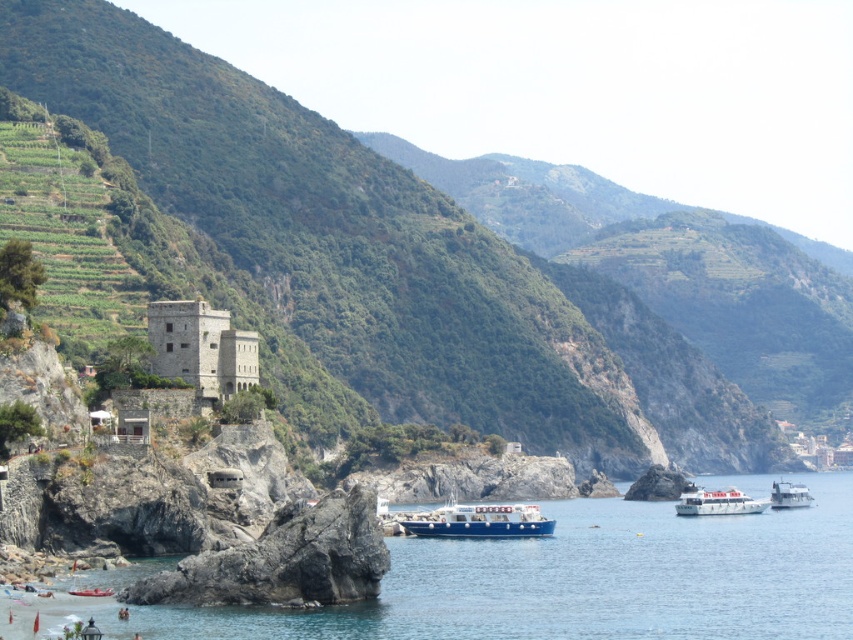
Does white glossy ferry at center come in front of white glossy boat at lower right?

Yes, it is in front of white glossy boat at lower right.

Between point (726, 490) and point (776, 481), which one is positioned behind?

Positioned behind is point (776, 481).

In order to click on white glossy ferry at center in this screenshot , I will do `click(717, 502)`.

Can you confirm if clear blue water at lower left is wider than blue matte boat at center?

Yes, clear blue water at lower left is wider than blue matte boat at center.

Is point (450, 561) closer to camera compared to point (407, 532)?

That is True.

What are the coordinates of `clear blue water at lower left` in the screenshot? It's located at (561, 580).

Which is in front, point (552, 609) or point (682, 499)?

Positioned in front is point (552, 609).

Is clear blue water at lower left further to the viewer compared to white glossy ferry at center?

No, it is not.

Is point (828, 477) positioned in front of point (699, 512)?

No.

Locate an element on the screen. This screenshot has width=853, height=640. clear blue water at lower left is located at coordinates (561, 580).